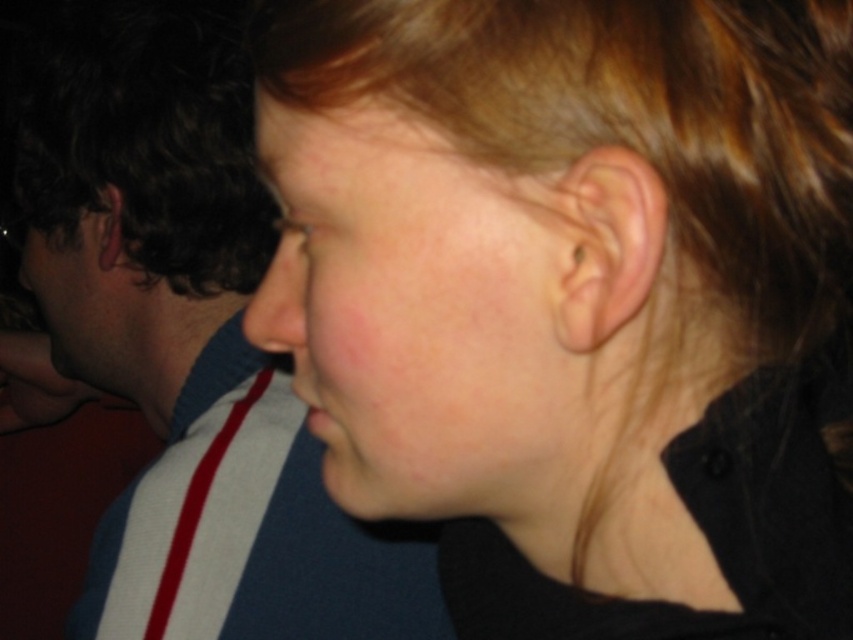
Question: Considering the relative positions of smooth skin face at center and smooth skin at center in the image provided, where is smooth skin face at center located with respect to smooth skin at center?

Choices:
 (A) right
 (B) left

Answer: (A)

Question: Among these points, which one is nearest to the camera?

Choices:
 (A) (70, 305)
 (B) (256, 320)

Answer: (B)

Question: Among these points, which one is nearest to the camera?

Choices:
 (A) (306, 307)
 (B) (86, 321)

Answer: (A)

Question: Which point is closer to the camera taking this photo?

Choices:
 (A) (300, 275)
 (B) (241, 148)
 (C) (28, 244)
 (D) (302, 157)

Answer: (D)

Question: Is smooth skin face at center wider than smooth skin at center?

Choices:
 (A) no
 (B) yes

Answer: (B)

Question: Is smooth skin face at center smaller than matte blue shirt at left?

Choices:
 (A) yes
 (B) no

Answer: (A)